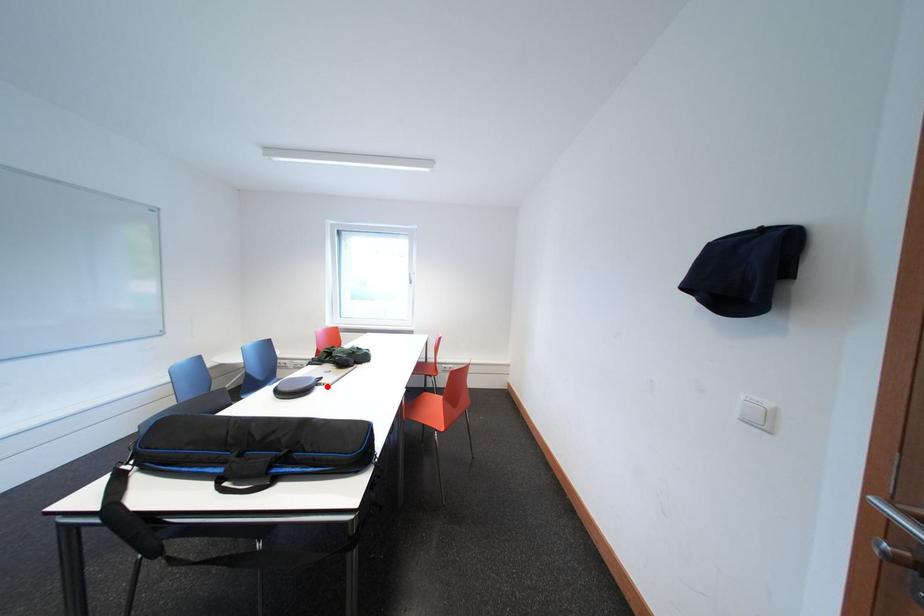
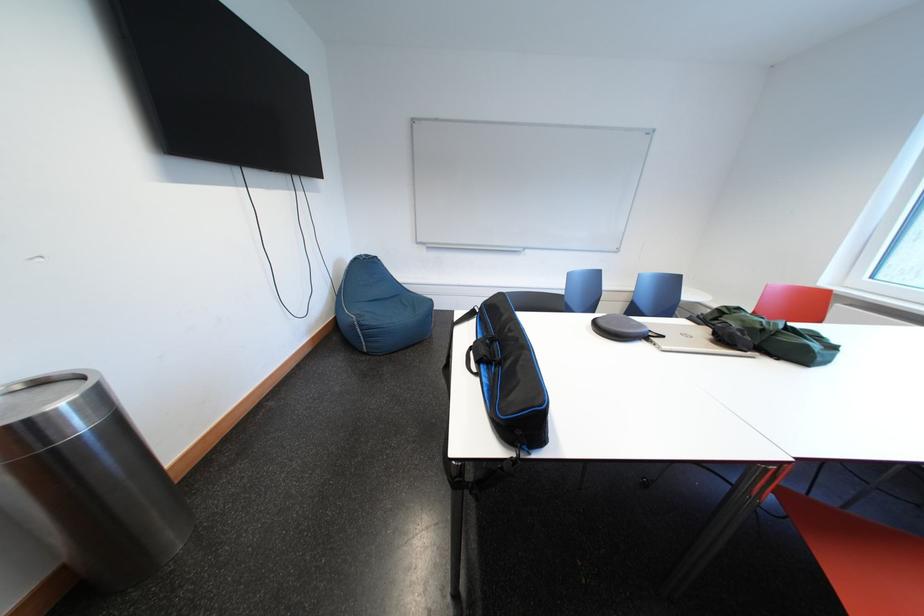
Locate, in the second image, the point that corresponds to the highlighted location in the first image.

(657, 341)